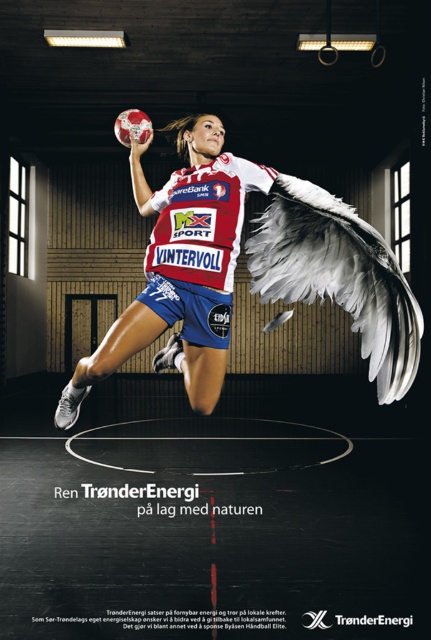
What object is located at the coordinates point (249,269) in the image?

The point (249,269) corresponds to the matte white jersey at center.

Based on the scene description, can you determine the spatial relationship between the white feathered wing at upper center and the white jersey at center?

The white feathered wing at upper center is located below the white jersey at center.

You are a photographer standing in the sports hall. You want to take a photo of the white jersey at center and the white feathered wing at upper center. Can you fit both objects in your camera frame if the maximum distance your camera can capture is 12 inches?

The distance between the white feathered wing at upper center and the white jersey at center is 13.07 inches, which exceeds the camera frame limit of 12 inches. Therefore, both objects cannot be captured in a single frame.